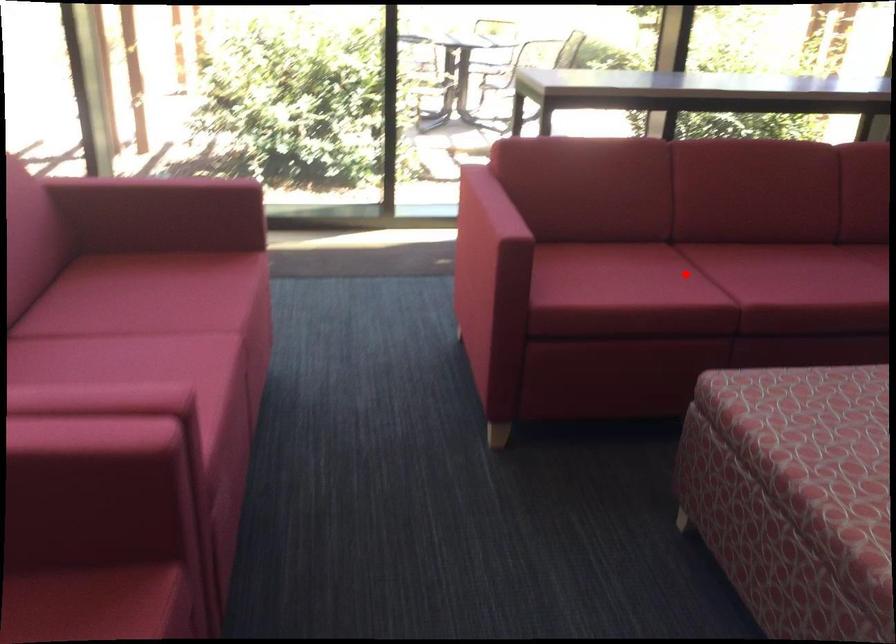
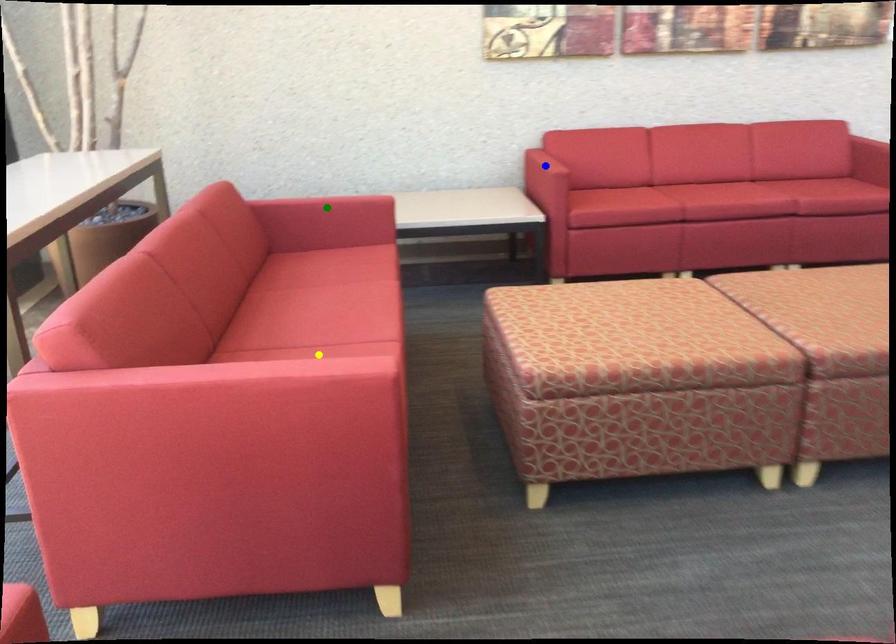
Question: I am providing you with two images of the same scene from different viewpoints. A red point is marked on the first image. You are given multiple points on the second image. Which point in image 2 is actually the same real-world point as the red point in image 1?

Choices:
 (A) green point
 (B) yellow point
 (C) blue point

Answer: (B)